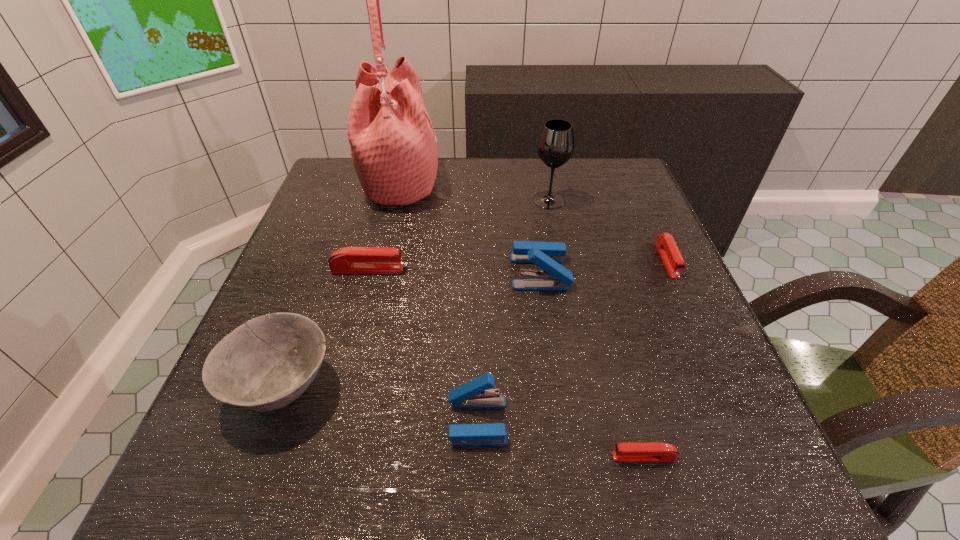
Identify the location of the rightmost stapler. This screenshot has height=540, width=960. (665, 243).

At what (x,y) coordinates should I click in order to perform the action: click on the second shortest stapler. Please return your answer as a coordinate pair (x, y). Looking at the image, I should click on (665, 243).

You are a GUI agent. You are given a task and a screenshot of the screen. Output one action in this format:
    pyautogui.click(x=<x>, y=<y>)
    Task: Click on the second red stapler from left to right
    Image resolution: width=960 pixels, height=540 pixels.
    Given the screenshot: What is the action you would take?
    pyautogui.click(x=648, y=451)

The image size is (960, 540). I want to click on the nearest red stapler, so click(648, 451).

The height and width of the screenshot is (540, 960). I want to click on vacant space located 0.050m on the left of the handbag, so click(x=343, y=183).

At what (x,y) coordinates should I click in order to perform the action: click on free space located 0.090m on the right of the seventh shortest object. Please return your answer as a coordinate pair (x, y). Looking at the image, I should click on (601, 200).

At what (x,y) coordinates should I click in order to perform the action: click on free space located on the back of the farther blue stapler. Please return your answer as a coordinate pair (x, y). Image resolution: width=960 pixels, height=540 pixels. Looking at the image, I should click on (535, 232).

Identify the location of vacant region located 0.130m on the right of the bowl. (416, 387).

You are a GUI agent. You are given a task and a screenshot of the screen. Output one action in this format:
    pyautogui.click(x=<x>, y=<y>)
    Task: Click on the vacant space located on the left of the left blue stapler
    The image size is (960, 540).
    Given the screenshot: What is the action you would take?
    pyautogui.click(x=396, y=420)

At what (x,y) coordinates should I click in order to perform the action: click on vacant space positioned 0.120m on the front-facing side of the biggest red stapler. Please return your answer as a coordinate pair (x, y). Image resolution: width=960 pixels, height=540 pixels. Looking at the image, I should click on (460, 269).